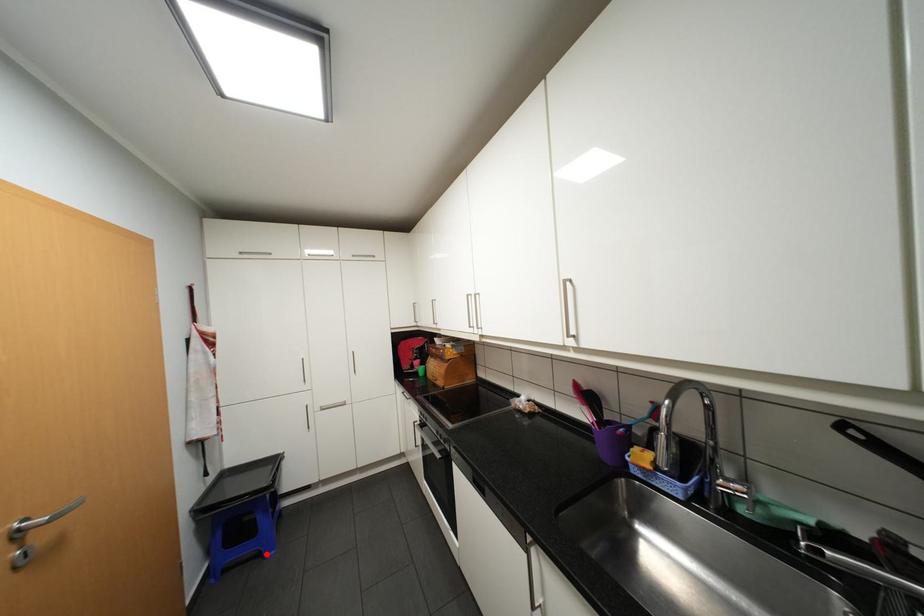
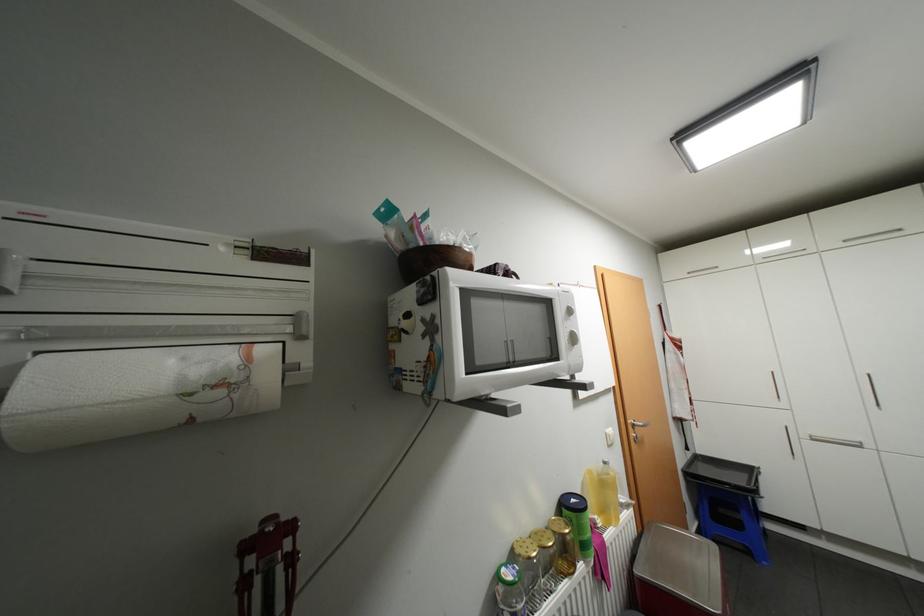
Find the pixel in the second image that matches the highlighted location in the first image.

(756, 552)